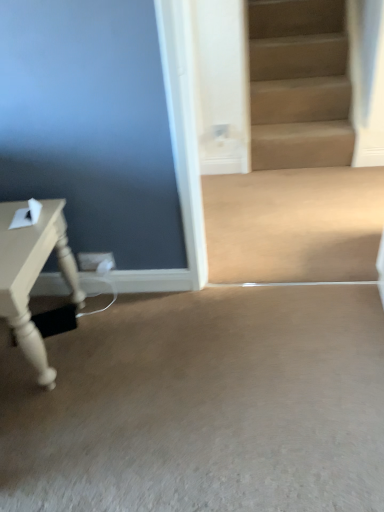
The image size is (384, 512). In order to click on vacant region under matte white table at left (from a real-world perspective) in this screenshot , I will do `click(43, 344)`.